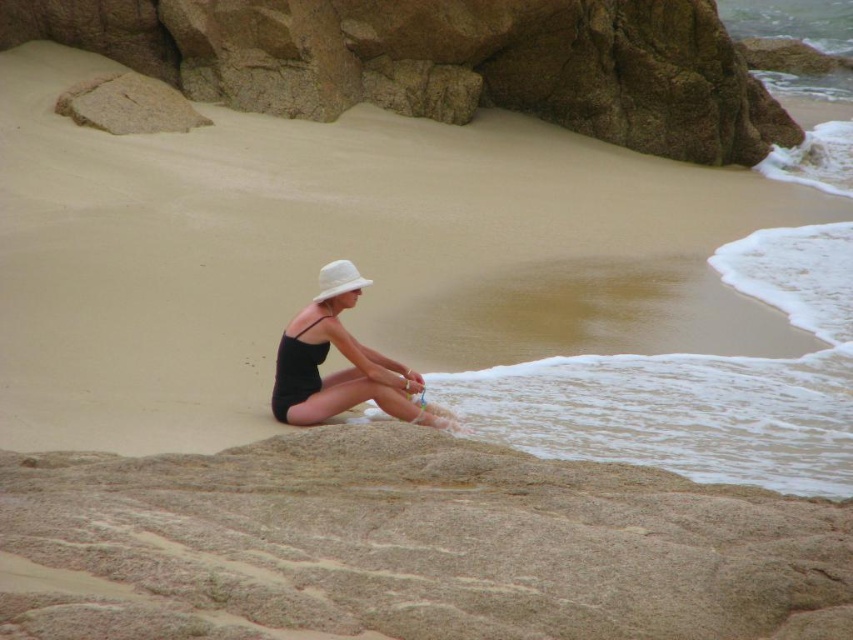
Who is taller, matte black swimsuit at center or white matte hat at center?

Standing taller between the two is matte black swimsuit at center.

What do you see at coordinates (343, 369) in the screenshot?
I see `matte black swimsuit at center` at bounding box center [343, 369].

Image resolution: width=853 pixels, height=640 pixels. In order to click on matte black swimsuit at center in this screenshot , I will do 343,369.

Which is more to the left, smooth beige sand at lower center or matte black swimsuit at center?

Positioned to the left is matte black swimsuit at center.

Which is in front, point (178, 520) or point (279, 410)?

Point (178, 520)

Which is in front, point (115, 509) or point (354, 273)?

Point (115, 509)

Where is `smooth beige sand at lower center`? This screenshot has width=853, height=640. smooth beige sand at lower center is located at coordinates (419, 545).

Which of these two, smooth beige sand at lower center or white matte hat at center, stands shorter?

white matte hat at center is shorter.

Between smooth beige sand at lower center and white matte hat at center, which one is positioned higher?

Positioned higher is white matte hat at center.

Who is more distant from viewer, (703, 508) or (328, 273)?

Positioned behind is point (328, 273).

The height and width of the screenshot is (640, 853). In order to click on smooth beige sand at lower center in this screenshot , I will do `click(419, 545)`.